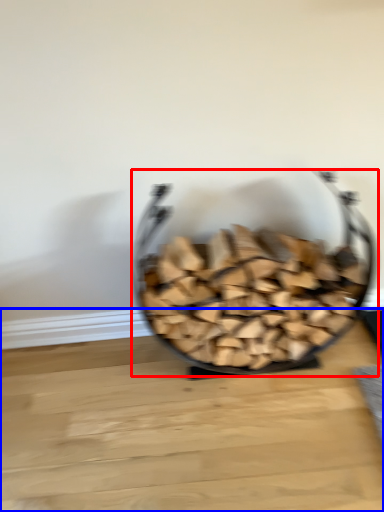
Question: Which of the following is the farthest to the observer, tableware (highlighted by a red box) or table top (highlighted by a blue box)?

Choices:
 (A) tableware
 (B) table top

Answer: (B)